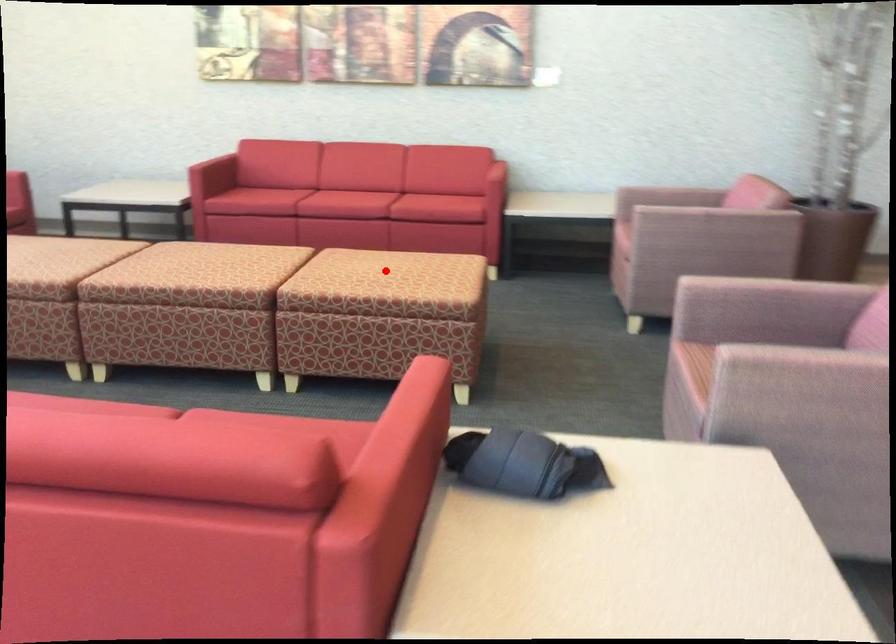
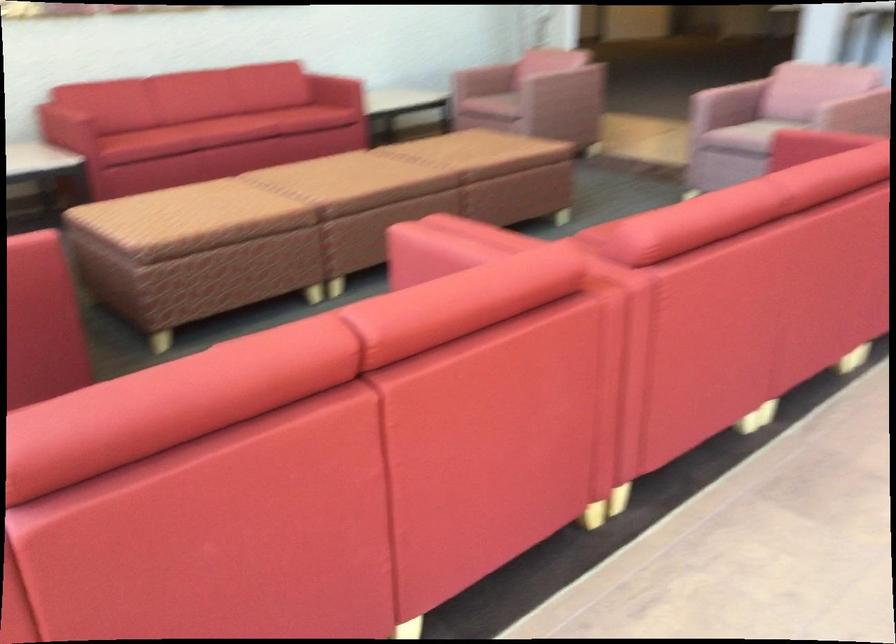
The point at the highlighted location is marked in the first image. Where is the corresponding point in the second image?

(481, 152)